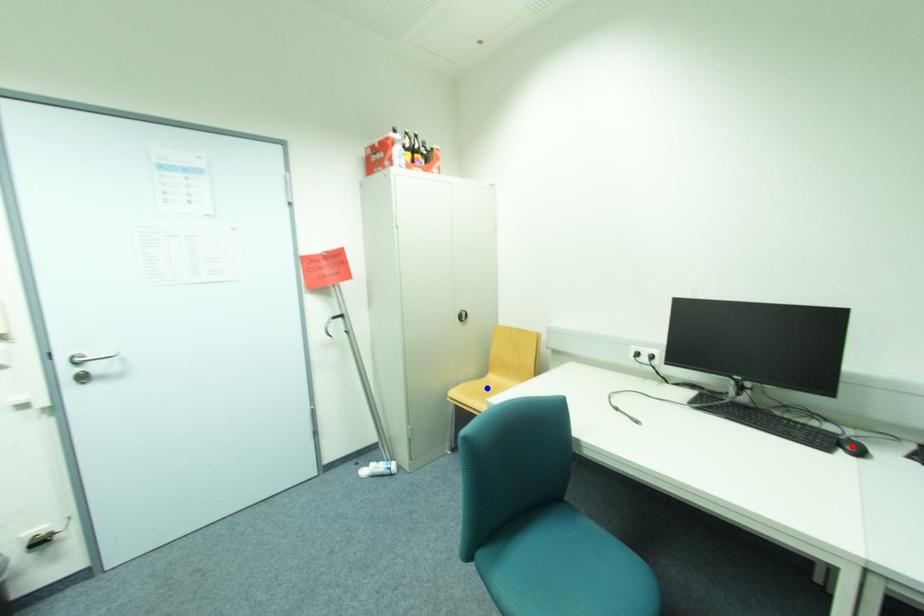
Question: Which of the two points in the image is closer to the camera?

Choices:
 (A) Blue point is closer.
 (B) Red point is closer.

Answer: (B)